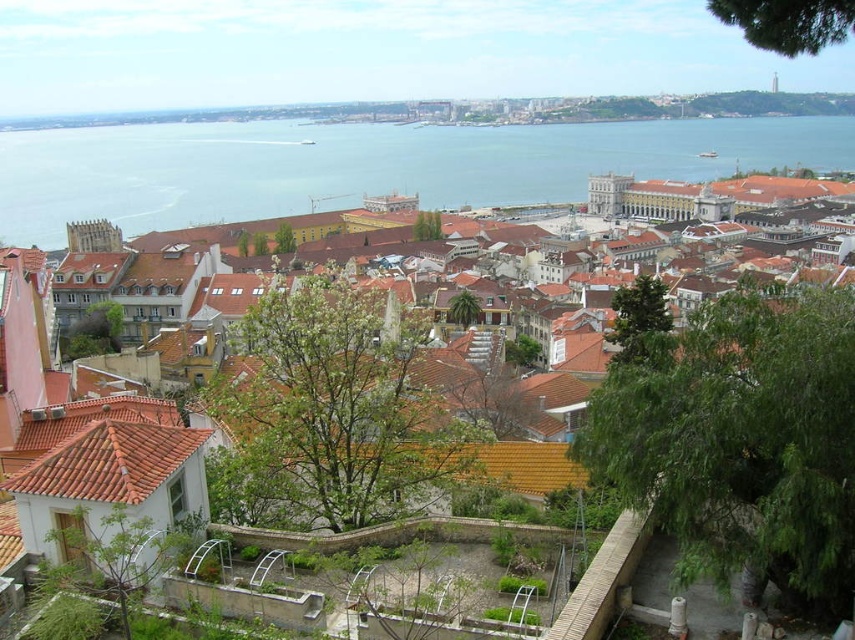
Question: Is brown tiled roofs at center smaller than blue water at center?

Choices:
 (A) no
 (B) yes

Answer: (B)

Question: Does brown tiled roofs at center lie behind blue water at center?

Choices:
 (A) no
 (B) yes

Answer: (A)

Question: Can you confirm if brown tiled roofs at center is smaller than blue water at center?

Choices:
 (A) yes
 (B) no

Answer: (A)

Question: Which of the following is the farthest from the observer?

Choices:
 (A) brown tiled roofs at center
 (B) blue water at center

Answer: (B)